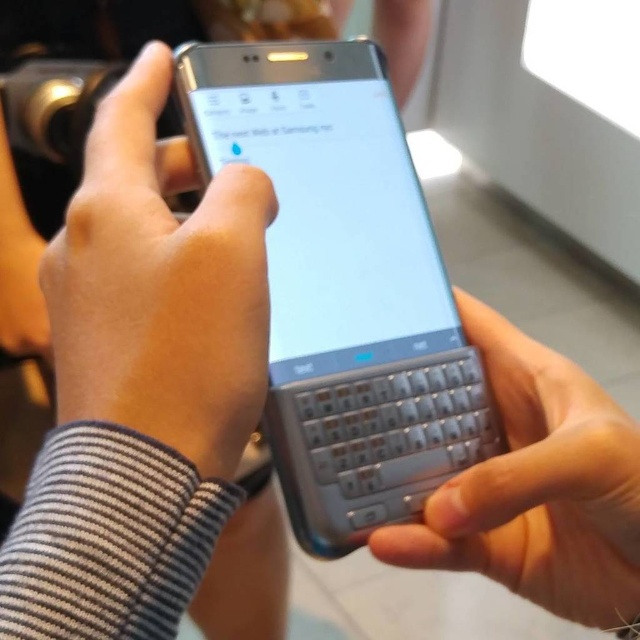
Question: Which of the following is the closest to the observer?

Choices:
 (A) silver metallic keyboard at center
 (B) slate metallic keyboard at center
 (C) matte black phone at center

Answer: (C)

Question: Is slate metallic keyboard at center positioned before silver metallic keyboard at center?

Choices:
 (A) no
 (B) yes

Answer: (A)

Question: Can you confirm if matte black phone at center is positioned above silver metallic keyboard at center?

Choices:
 (A) yes
 (B) no

Answer: (A)

Question: Which point is closer to the camera taking this photo?

Choices:
 (A) (525, 563)
 (B) (132, 326)

Answer: (B)

Question: Can you confirm if slate metallic keyboard at center is wider than matte black phone at center?

Choices:
 (A) yes
 (B) no

Answer: (A)

Question: Which point appears farthest from the camera in this image?

Choices:
 (A) (540, 515)
 (B) (93, 179)
 (C) (472, 378)

Answer: (C)